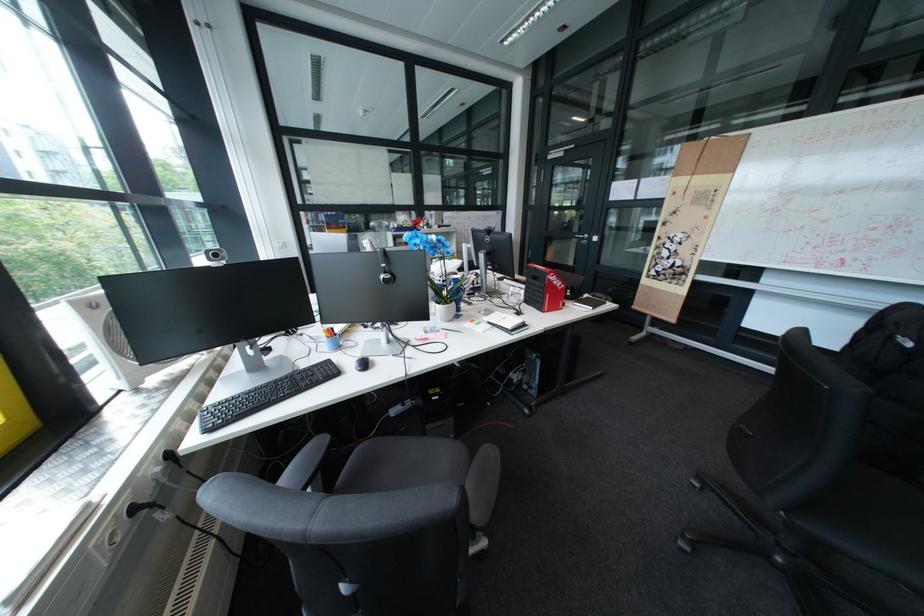
The image size is (924, 616). Describe the element at coordinates (400, 464) in the screenshot. I see `the grey chair sitting surface` at that location.